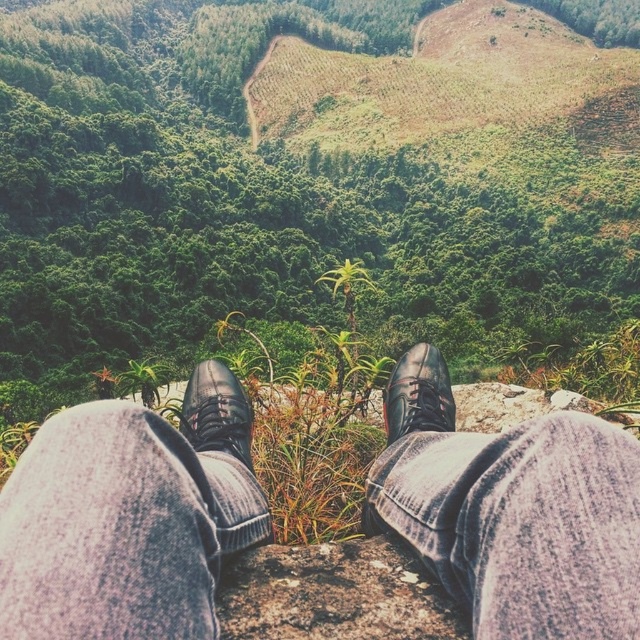
Question: Does denim pants at lower center have a greater width compared to shiny black shoe at center?

Choices:
 (A) no
 (B) yes

Answer: (A)

Question: Which point is closer to the camera?

Choices:
 (A) (208, 385)
 (B) (442, 177)
 (C) (428, 369)

Answer: (A)

Question: Which point is farther to the camera?

Choices:
 (A) black leather shoe at center
 (B) denim pants at lower center
 (C) green leafy vegetation at center
 (D) shiny black shoe at center

Answer: (C)

Question: Does denim pants at lower center have a greater width compared to shiny black shoe at center?

Choices:
 (A) yes
 (B) no

Answer: (B)

Question: Does denim pants at lower center have a larger size compared to shiny black shoe at center?

Choices:
 (A) no
 (B) yes

Answer: (A)

Question: Considering the real-world distances, which object is closest to the green leafy vegetation at center?

Choices:
 (A) black leather shoe at center
 (B) denim pants at lower center

Answer: (B)